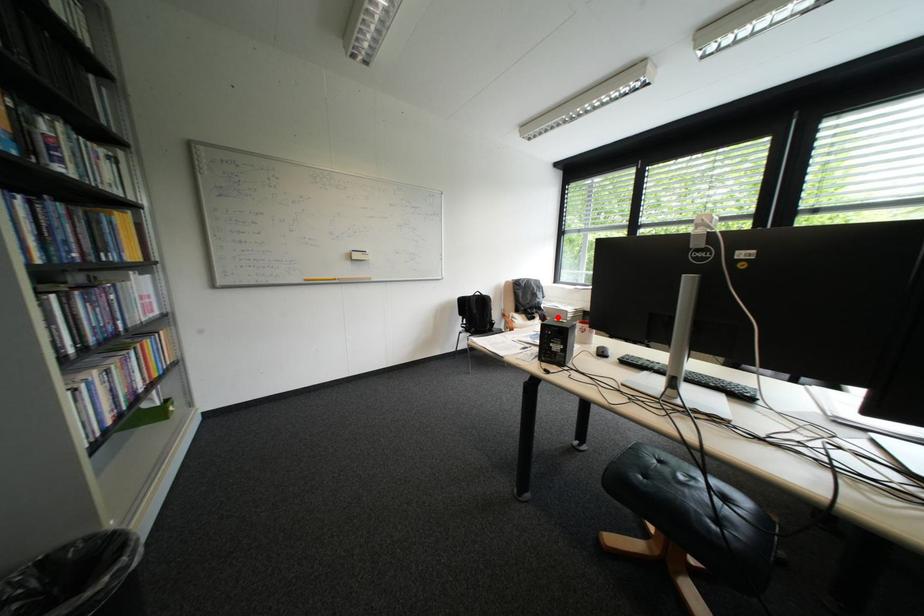
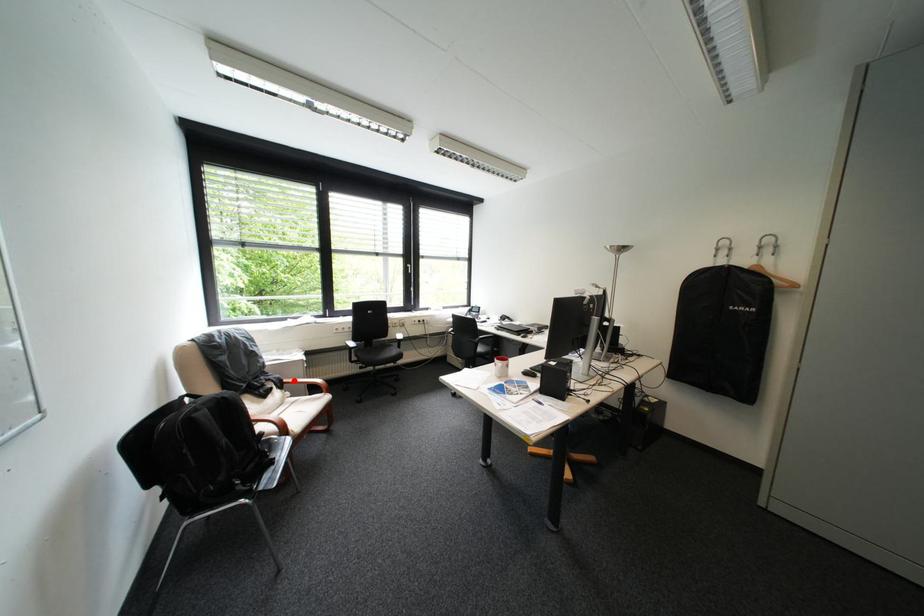
I am providing you with two images of the same scene from different viewpoints. A red point is marked on the first image and another point is marked on the second image. Are the points marked in image1 and image2 representing the same 3D position?

Yes